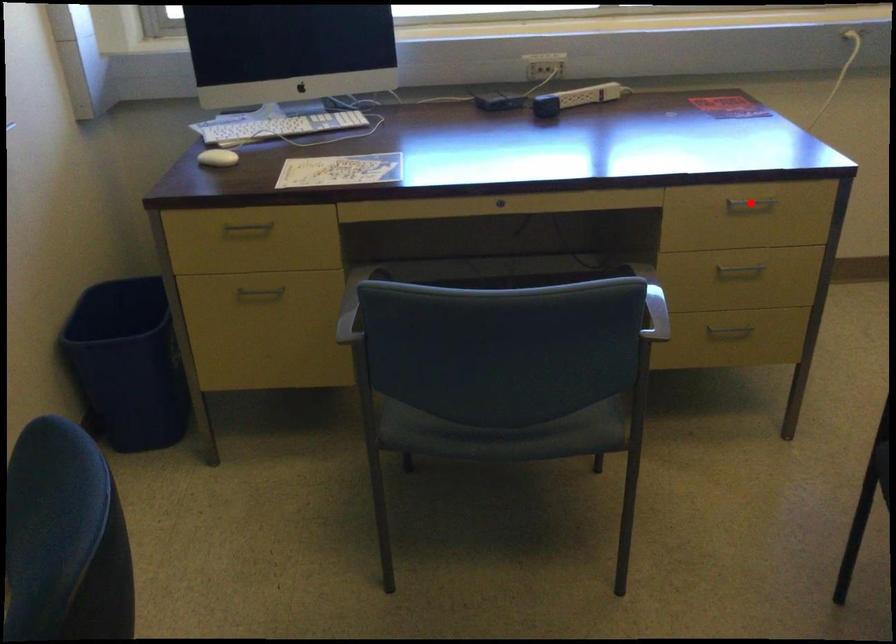
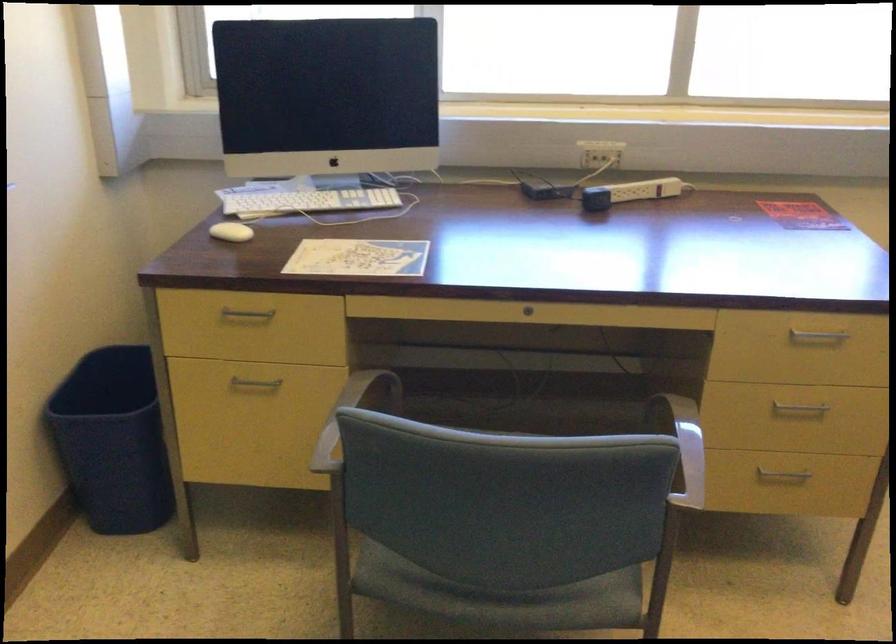
Find the pixel in the second image that matches the highlighted location in the first image.

(816, 336)